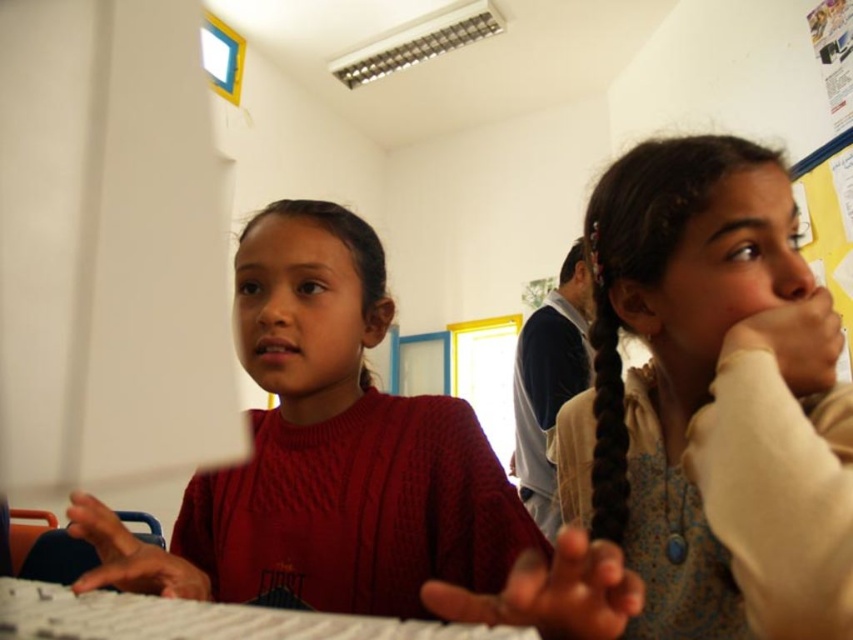
Does light brown textured sweater at right have a lesser height compared to black silky hair at right?

In fact, light brown textured sweater at right may be taller than black silky hair at right.

How far apart are light brown textured sweater at right and black silky hair at right?

2.83 inches

Find the location of a particular element. light brown textured sweater at right is located at coordinates (712, 401).

Who is more distant from viewer, (648, 275) or (80, 636)?

Positioned behind is point (648, 275).

Locate an element on the screen. This screenshot has height=640, width=853. light brown textured sweater at right is located at coordinates (712, 401).

Can you confirm if cable-knit sweater at center is positioned to the right of white plastic keyboard at center?

Correct, you'll find cable-knit sweater at center to the right of white plastic keyboard at center.

Does cable-knit sweater at center have a smaller size compared to white plastic keyboard at center?

Incorrect, cable-knit sweater at center is not smaller in size than white plastic keyboard at center.

What do you see at coordinates (325, 452) in the screenshot? I see `cable-knit sweater at center` at bounding box center [325, 452].

The width and height of the screenshot is (853, 640). I want to click on cable-knit sweater at center, so click(x=325, y=452).